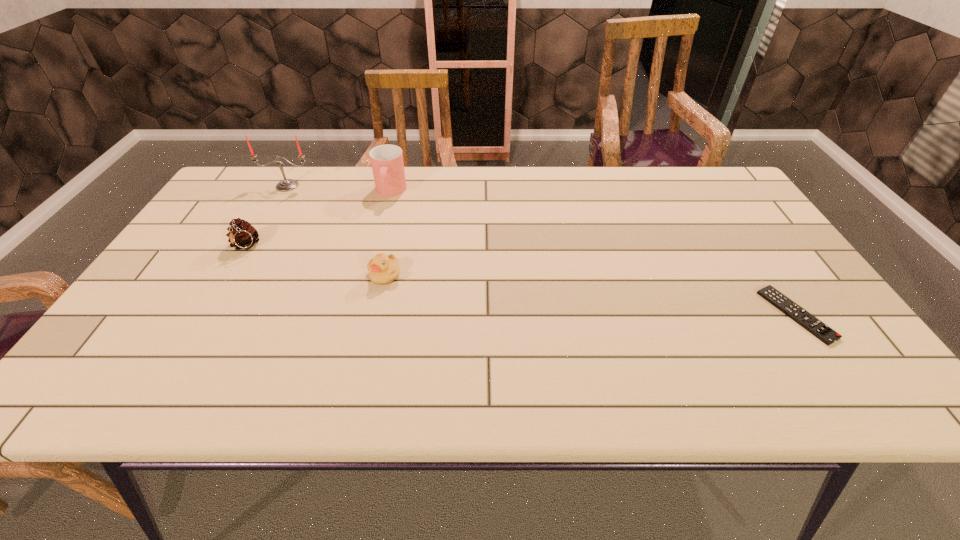
Locate an element on the screen. vacant area at the near edge is located at coordinates (361, 397).

This screenshot has width=960, height=540. I want to click on vacant space at the left edge, so click(205, 256).

This screenshot has width=960, height=540. Identify the location of vacant area at the right edge of the desktop. (853, 348).

Identify the location of blank space at the near left corner of the desktop. (94, 400).

In the image, there is a desktop. Where is `free space at the far right corner`? free space at the far right corner is located at coordinates [x=675, y=169].

Find the location of a particular element. vacant space at the near right corner of the desktop is located at coordinates (838, 396).

Identify the location of vacant point located between the fourth farthest object and the pinecone. Image resolution: width=960 pixels, height=540 pixels. (315, 261).

You are a GUI agent. You are given a task and a screenshot of the screen. Output one action in this format:
    pyautogui.click(x=<x>, y=<y>)
    Task: Click on the unoccupied position between the second tallest object and the duckling
    The width and height of the screenshot is (960, 540).
    Given the screenshot: What is the action you would take?
    pyautogui.click(x=388, y=233)

Find the location of a particular element. The width and height of the screenshot is (960, 540). vacant area between the fourth shortest object and the pinecone is located at coordinates (318, 219).

This screenshot has width=960, height=540. Find the location of `free space between the pinecone and the cup`. free space between the pinecone and the cup is located at coordinates (318, 219).